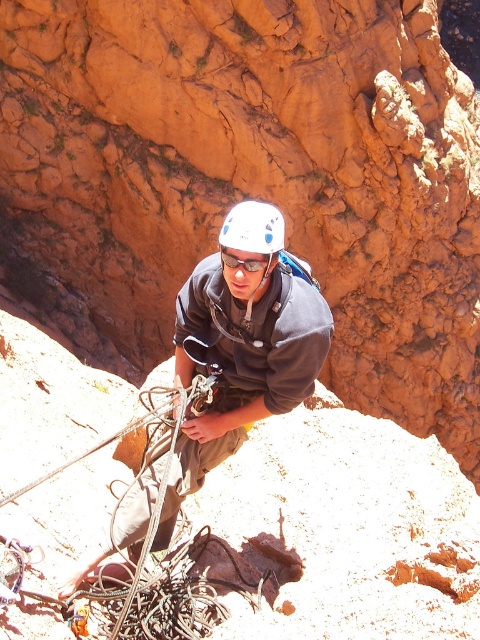
Question: Which of these objects is positioned farthest from the matte gray helmet at center?

Choices:
 (A) white matte helmet at center
 (B) clear plastic goggles at center

Answer: (A)

Question: Does matte gray helmet at center come behind white matte helmet at center?

Choices:
 (A) no
 (B) yes

Answer: (B)

Question: Which object is farther from the camera taking this photo?

Choices:
 (A) white matte helmet at center
 (B) matte gray helmet at center

Answer: (B)

Question: Can you confirm if matte gray helmet at center is thinner than white matte helmet at center?

Choices:
 (A) yes
 (B) no

Answer: (A)

Question: Does white matte helmet at center come in front of clear plastic goggles at center?

Choices:
 (A) yes
 (B) no

Answer: (B)

Question: Which of the following is the farthest from the observer?

Choices:
 (A) white matte helmet at center
 (B) clear plastic goggles at center

Answer: (A)